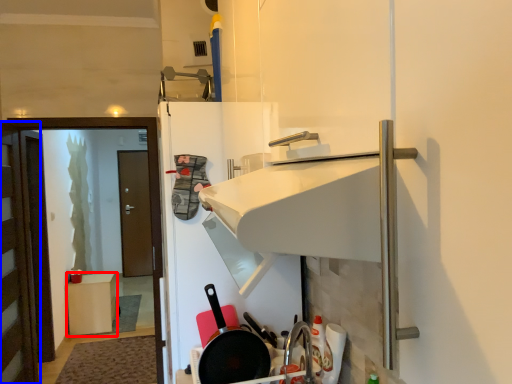
Question: Which of the following is the closest to the observer, furniture (highlighted by a red box) or door (highlighted by a blue box)?

Choices:
 (A) furniture
 (B) door

Answer: (B)